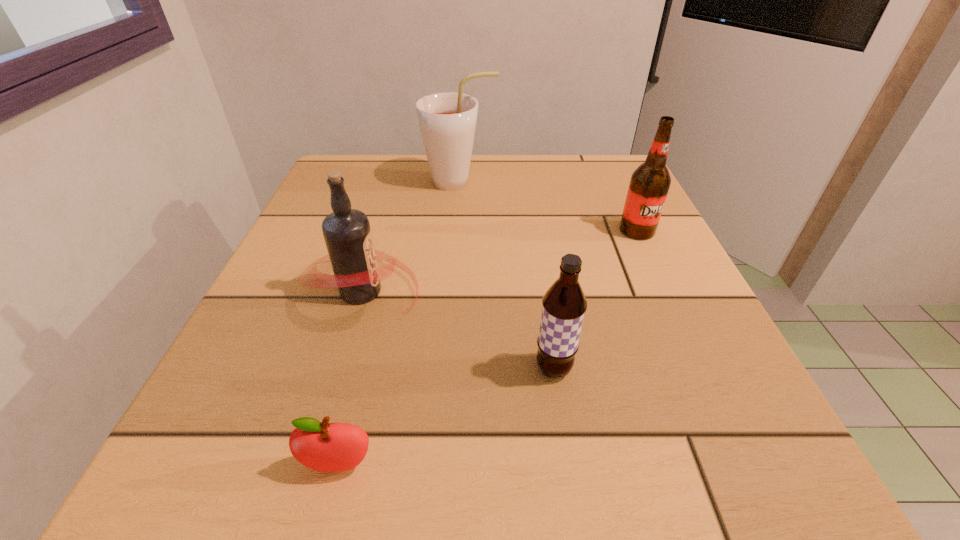
I want to click on vacant space at the near edge, so click(382, 446).

Where is `vacant region at the left edge`? The image size is (960, 540). vacant region at the left edge is located at coordinates (287, 248).

What are the coordinates of `vacant space at the right edge` in the screenshot? It's located at (665, 255).

Where is `vacant region at the far left corner of the desktop`? The image size is (960, 540). vacant region at the far left corner of the desktop is located at coordinates (362, 173).

This screenshot has height=540, width=960. In the image, there is a desktop. What are the coordinates of `vacant area at the near left corner` in the screenshot? It's located at pos(234,436).

I want to click on vacant position at the far right corner of the desktop, so click(x=573, y=172).

Where is `vacant point at the near right corner`? vacant point at the near right corner is located at coordinates (750, 460).

You are a GUI agent. You are given a task and a screenshot of the screen. Output one action in this format:
    pyautogui.click(x=<x>, y=<y>)
    Task: Click on the vacant space in between the rightmost object and the farthest object
    The height and width of the screenshot is (540, 960).
    Given the screenshot: What is the action you would take?
    pyautogui.click(x=548, y=206)

Locate an element on the screen. free spot between the nearest root beer and the shortest object is located at coordinates (446, 417).

The height and width of the screenshot is (540, 960). Find the location of `free spot between the second nearest object and the shortest object`. free spot between the second nearest object and the shortest object is located at coordinates (446, 417).